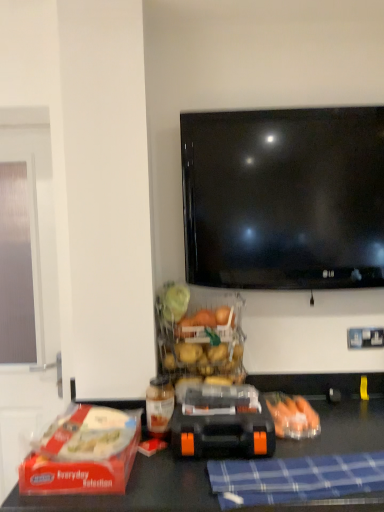
The height and width of the screenshot is (512, 384). Find the location of `empty space that is ontop of red plastic lunch box at lower left`. empty space that is ontop of red plastic lunch box at lower left is located at coordinates (86, 439).